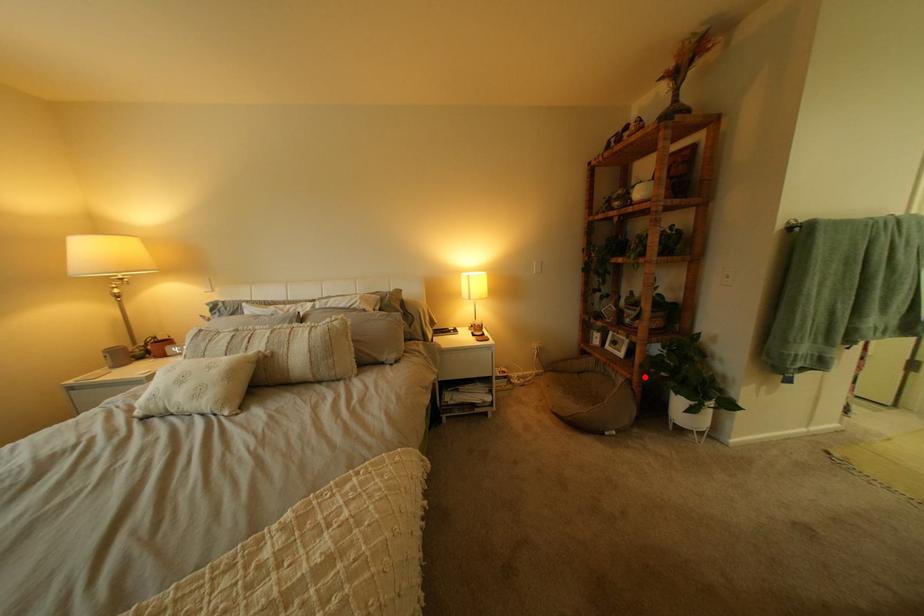
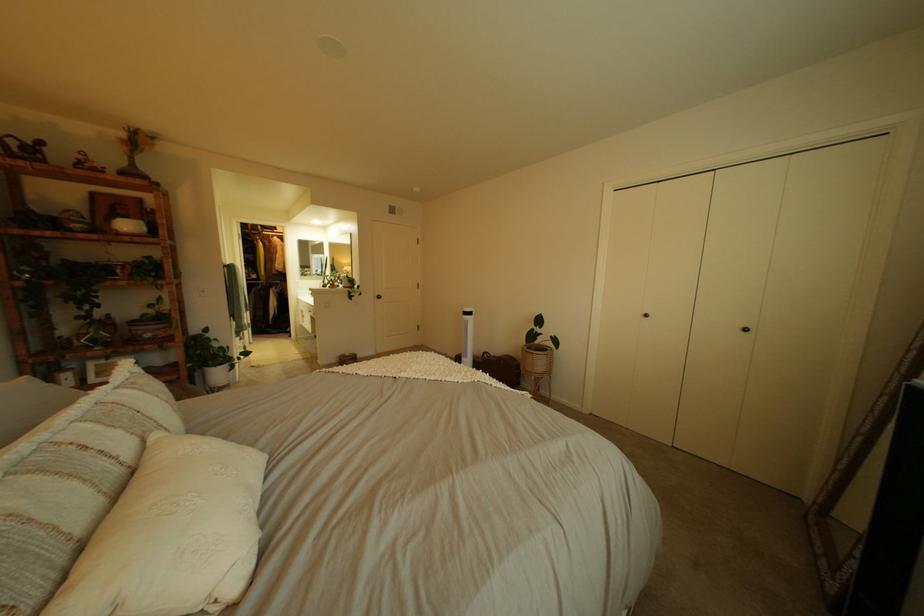
Question: I am providing you with two images of the same scene from different viewpoints. In image1, a red point is highlighted. Considering the same 3D point in image2, which of the following is correct?

Choices:
 (A) It is closer
 (B) It is farther

Answer: (A)